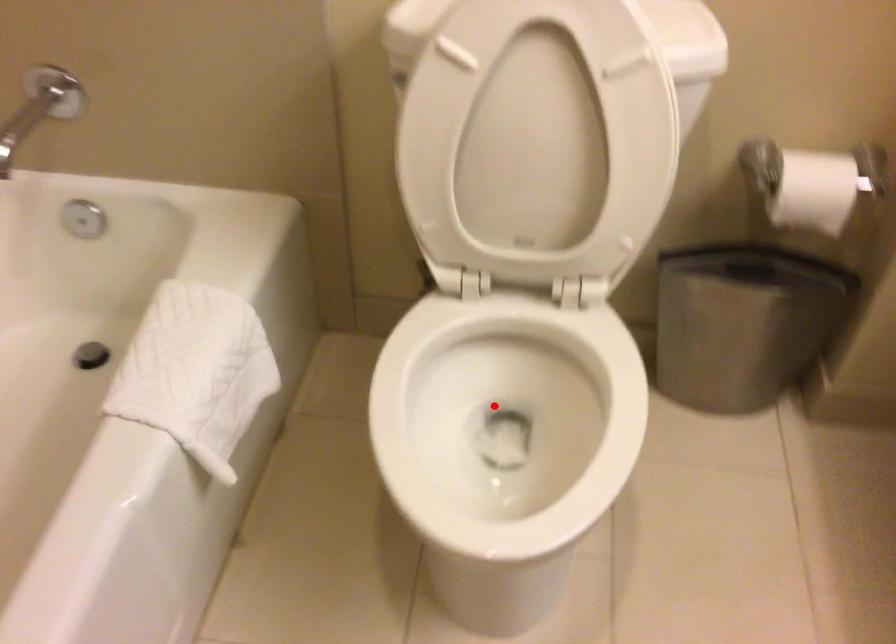
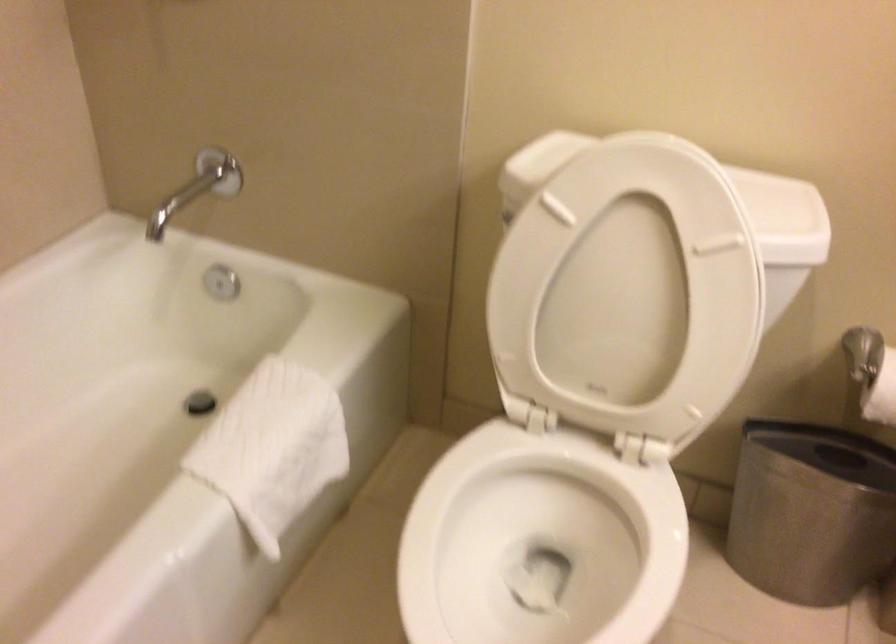
In the second image, find the point that corresponds to the highlighted location in the first image.

(539, 542)